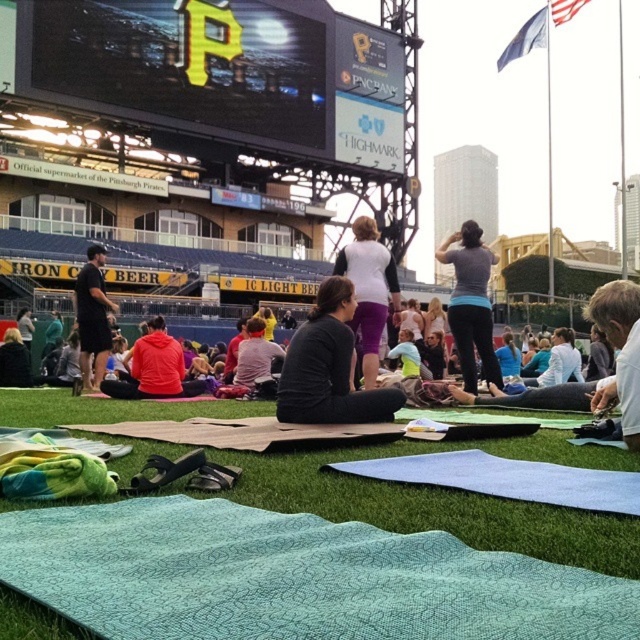
Looking at this image, does light blue fabric yoga mat at lower center have a greater height compared to dark gray hoodie at left?

No.

Can you confirm if light blue fabric yoga mat at lower center is smaller than dark gray hoodie at left?

→ Yes.

Looking at this image, who is more forward, (467, 480) or (100, 358)?

Positioned in front is point (467, 480).

Locate an element on the screen. light blue fabric yoga mat at lower center is located at coordinates (506, 477).

Between dark gray fabric pants at center and matte black jacket at lower left, which one is positioned higher?

Positioned higher is dark gray fabric pants at center.

Measure the distance from dark gray fabric pants at center to matte black jacket at lower left.

They are 7.28 meters apart.

Is point (333, 384) closer to camera compared to point (8, 362)?

Yes, point (333, 384) is closer to viewer.

Image resolution: width=640 pixels, height=640 pixels. I want to click on dark gray fabric pants at center, so click(x=330, y=368).

Is dark gray fabric pants at center positioned in front of orange fleece jacket at center?

That is True.

Is dark gray fabric pants at center smaller than orange fleece jacket at center?

Actually, dark gray fabric pants at center might be larger than orange fleece jacket at center.

Who is more forward, (x=320, y=392) or (x=164, y=346)?

Point (x=320, y=392) is in front.

In order to click on dark gray fabric pants at center in this screenshot , I will do `click(330, 368)`.